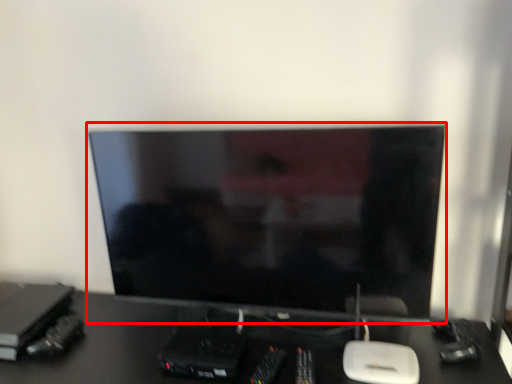
Question: From the image's perspective, what is the correct spatial relationship of computer monitor (annotated by the red box) in relation to desk?

Choices:
 (A) below
 (B) above

Answer: (B)